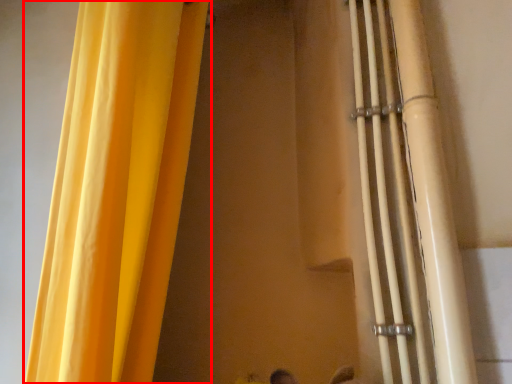
Question: From the image, what is the correct spatial relationship of curtain (annotated by the red box) in relation to pipe?

Choices:
 (A) left
 (B) right

Answer: (A)